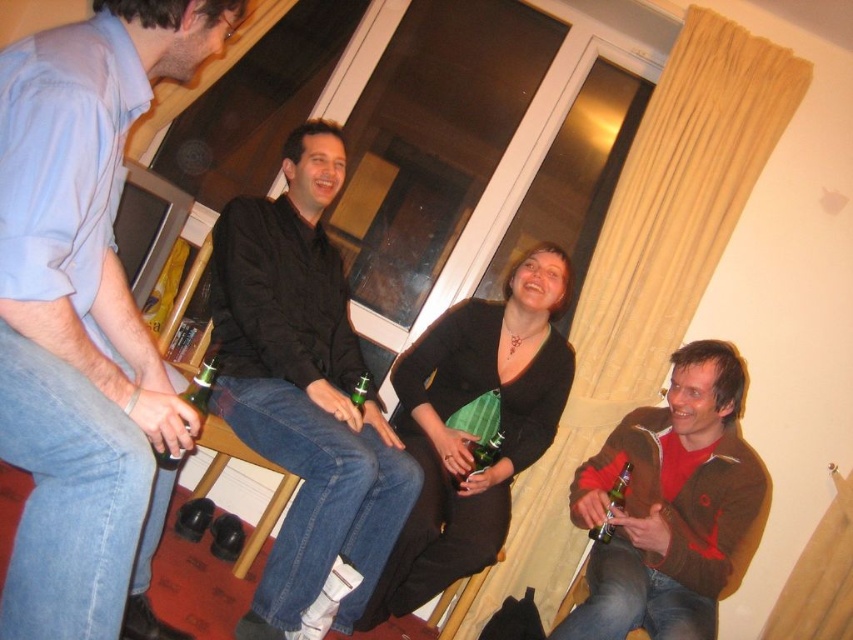
Is black matte dress at center further to camera compared to brown suede jacket at lower right?

Yes, it is.

What do you see at coordinates (474, 426) in the screenshot? This screenshot has height=640, width=853. I see `black matte dress at center` at bounding box center [474, 426].

You are a GUI agent. You are given a task and a screenshot of the screen. Output one action in this format:
    pyautogui.click(x=<x>, y=<y>)
    Task: Click on the black matte dress at center
    The height and width of the screenshot is (640, 853).
    Given the screenshot: What is the action you would take?
    pyautogui.click(x=474, y=426)

Does matte blue shirt at left appear on the right side of brown suede jacket at lower right?

No, matte blue shirt at left is not to the right of brown suede jacket at lower right.

Can you confirm if matte blue shirt at left is taller than brown suede jacket at lower right?

Yes, matte blue shirt at left is taller than brown suede jacket at lower right.

Between point (112, 65) and point (666, 616), which one is positioned in front?

Positioned in front is point (112, 65).

Locate an element on the screen. The width and height of the screenshot is (853, 640). matte blue shirt at left is located at coordinates (84, 316).

Does green glass bottle at lower right have a smaller size compared to green glass bottle at center?

No, green glass bottle at lower right is not smaller than green glass bottle at center.

Is green glass bottle at lower right in front of green glass bottle at center?

Yes, green glass bottle at lower right is closer to the viewer.

Find the location of `green glass bottle at lower right`. green glass bottle at lower right is located at coordinates (612, 504).